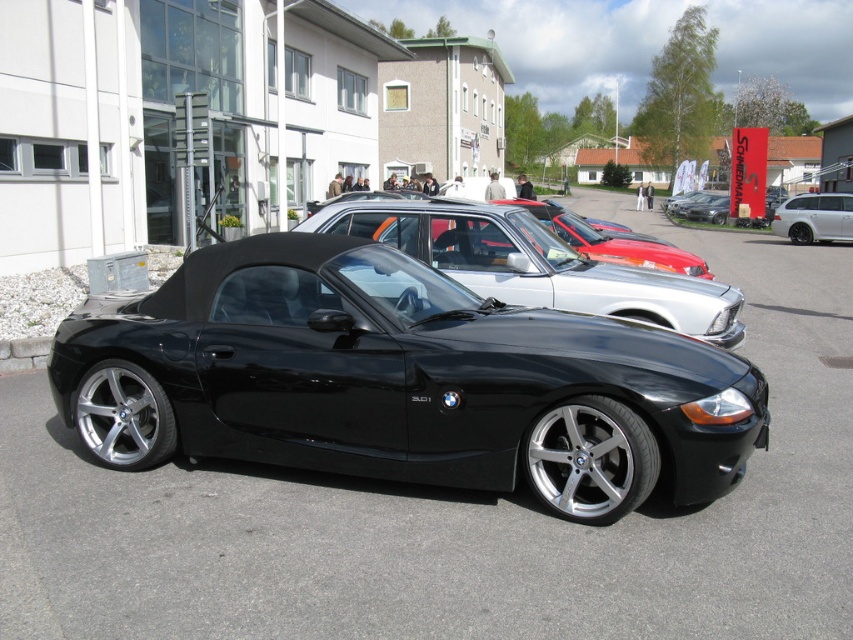
Question: Is silver metallic sedan at center to the left of white metallic suv at right from the viewer's perspective?

Choices:
 (A) yes
 (B) no

Answer: (A)

Question: Which point is farther to the camera?

Choices:
 (A) (817, 230)
 (B) (515, 243)

Answer: (A)

Question: Can you confirm if black car at center is positioned below silver metallic sedan at center?

Choices:
 (A) no
 (B) yes

Answer: (B)

Question: Among these points, which one is farthest from the camera?

Choices:
 (A) (810, 209)
 (B) (42, 465)
 (C) (407, 250)

Answer: (A)

Question: Considering the relative positions of black car at center and white metallic suv at right in the image provided, where is black car at center located with respect to white metallic suv at right?

Choices:
 (A) left
 (B) right

Answer: (A)

Question: Which of the following is the farthest from the observer?

Choices:
 (A) (798, 390)
 (B) (790, 234)

Answer: (B)